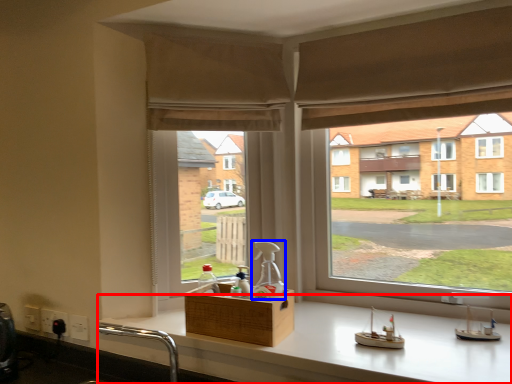
Question: Which of the following is the closest to the observer, counter (highlighted by a red box) or bottle (highlighted by a blue box)?

Choices:
 (A) counter
 (B) bottle

Answer: (A)